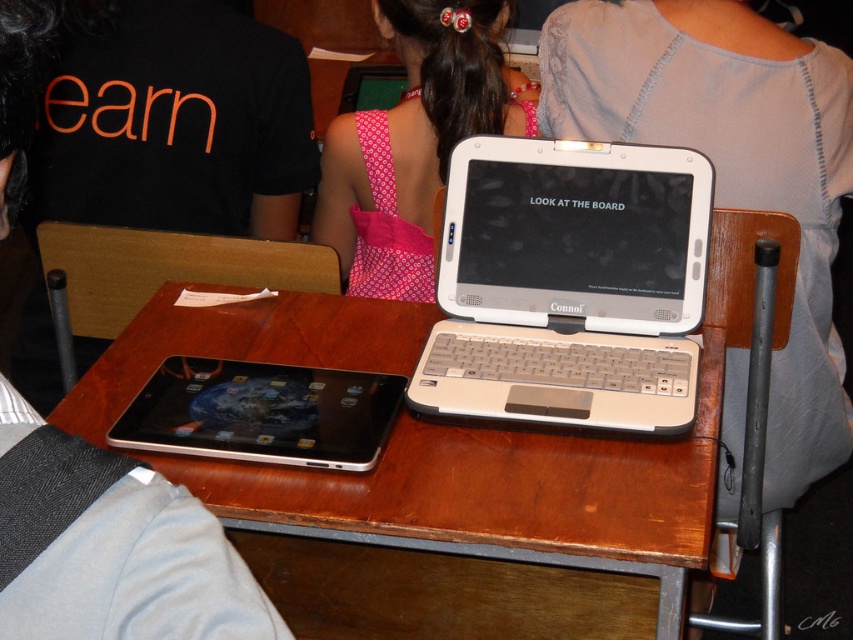
You are a student sitting at the desk in the classroom. You need to hand in your assignment to the teacher standing at the front of the room. The teacher is wearing the pink fabric dress at upper center. Before you stand up, you want to make sure you won not knock over the white plastic laptop at center. Based on their positions, is the laptop in a position where it might fall off the desk when you stand up?

The white plastic laptop at center is located below the pink fabric dress at upper center, meaning it is positioned lower on the desk. Since the laptop is placed toward the lower part of the desk, it is less likely to fall off when you stand up, as it is closer to the edge you would move away from. However, you should still check its placement to be safe.

You are a student in the classroom and you want to hand in your assignment to the teacher wearing the pink fabric dress at upper center. The silver metallic tablet at center is blocking your path. Can you move around the left side of the tablet to reach the teacher?

The pink fabric dress at upper center is positioned on the right side of silver metallic tablet at center, so you can move around the left side of the silver metallic tablet at center to reach the teacher.